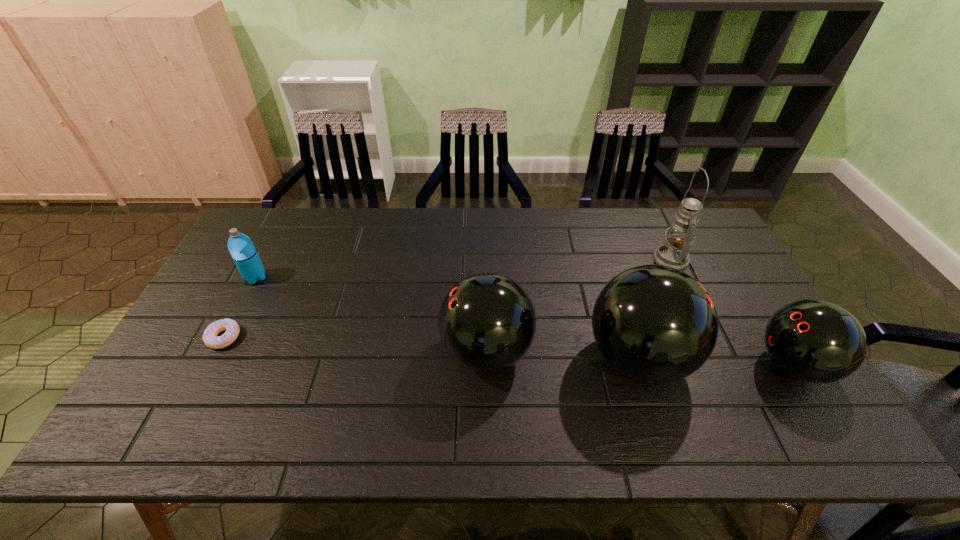
Locate an element on the screen. doughnut that is positioned at the left edge is located at coordinates (210, 338).

Image resolution: width=960 pixels, height=540 pixels. What are the coordinates of `bowling ball that is at the right edge` in the screenshot? It's located at click(815, 341).

This screenshot has width=960, height=540. I want to click on oil lamp at the right edge, so click(x=674, y=253).

Where is `object that is at the far right corner`? The height and width of the screenshot is (540, 960). object that is at the far right corner is located at coordinates (674, 253).

Where is `object situated at the near right corner`? Image resolution: width=960 pixels, height=540 pixels. object situated at the near right corner is located at coordinates (815, 341).

The image size is (960, 540). In the image, there is a desktop. What are the coordinates of `vacant space at the far edge` in the screenshot? It's located at (502, 236).

Find the location of a particular element. Image resolution: width=960 pixels, height=540 pixels. free space at the near edge of the desktop is located at coordinates (414, 384).

At what (x,y) coordinates should I click in order to perform the action: click on free location at the left edge. Please return your answer as a coordinate pair (x, y). The width and height of the screenshot is (960, 540). Looking at the image, I should click on (239, 309).

Where is `vacant space at the right edge of the desktop`? This screenshot has height=540, width=960. vacant space at the right edge of the desktop is located at coordinates (717, 306).

The width and height of the screenshot is (960, 540). Identify the location of free region at the far right corner. coord(696,240).